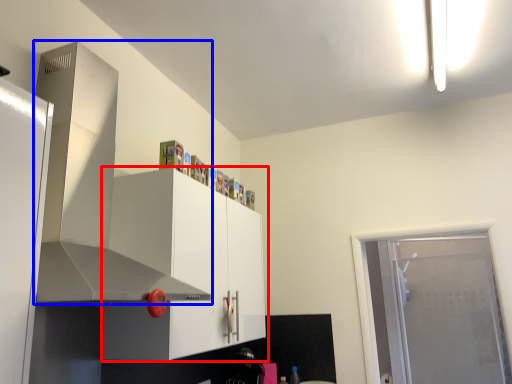
Question: Among these objects, which one is nearest to the camera, cabinetry (highlighted by a red box) or exhaust hood (highlighted by a blue box)?

Choices:
 (A) cabinetry
 (B) exhaust hood

Answer: (B)